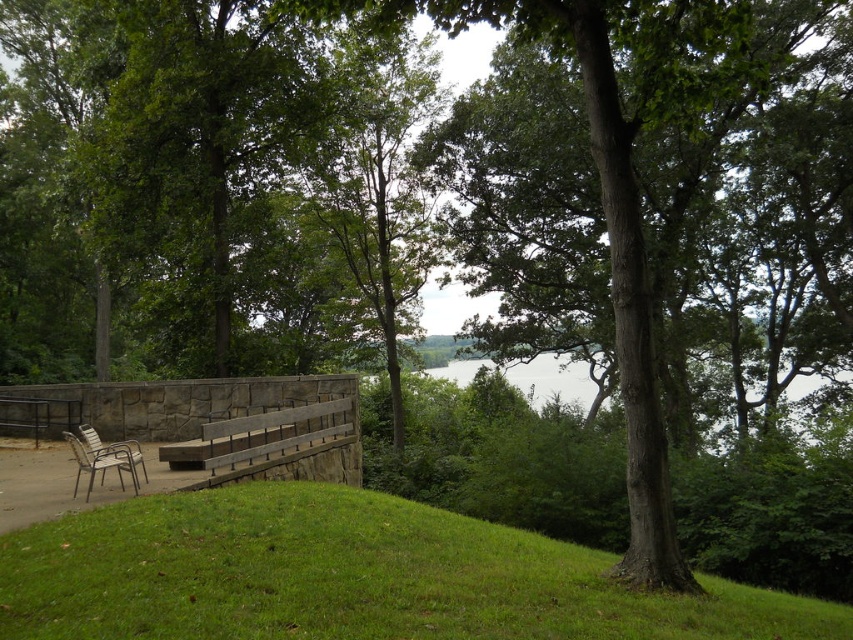
You are planning to take a photo of the green rough bark tree at center and the brown wooden bench at center from a distance. Which object will appear larger in the photo?

The green rough bark tree at center will appear larger in the photo because it is taller than the brown wooden bench at center.

From the picture: You are planning to set up a picnic and have a metallic silver chair at lower left and a green grassy hillside at lower left. Which object takes up more space?

The metallic silver chair at lower left takes up more space than the green grassy hillside at lower left according to the description.